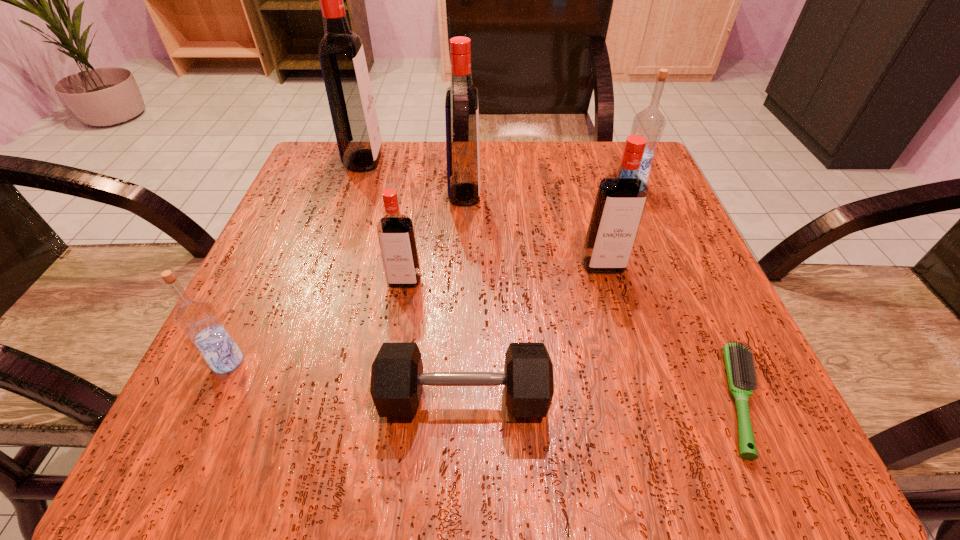
Identify the location of vacant space that satisfies the following two spatial constraints: 1. on the front and back of the second vodka from left to right; 2. on the right side of the shortest object. This screenshot has height=540, width=960. (282, 401).

Where is `vacant position in the image that satisfies the following two spatial constraints: 1. on the front and back of the bigger blue vodka; 2. on the left side of the tallest object`? The height and width of the screenshot is (540, 960). vacant position in the image that satisfies the following two spatial constraints: 1. on the front and back of the bigger blue vodka; 2. on the left side of the tallest object is located at coordinates [356, 185].